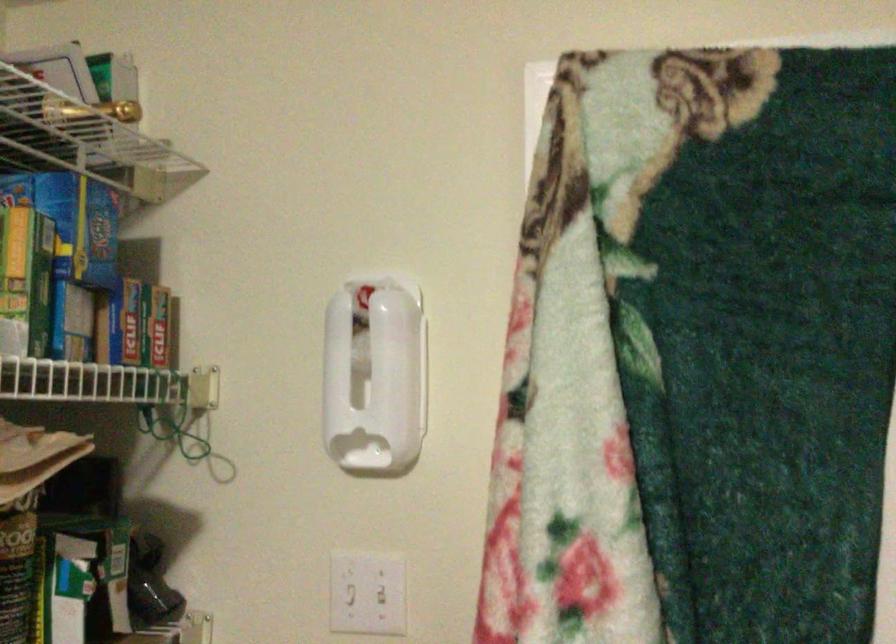
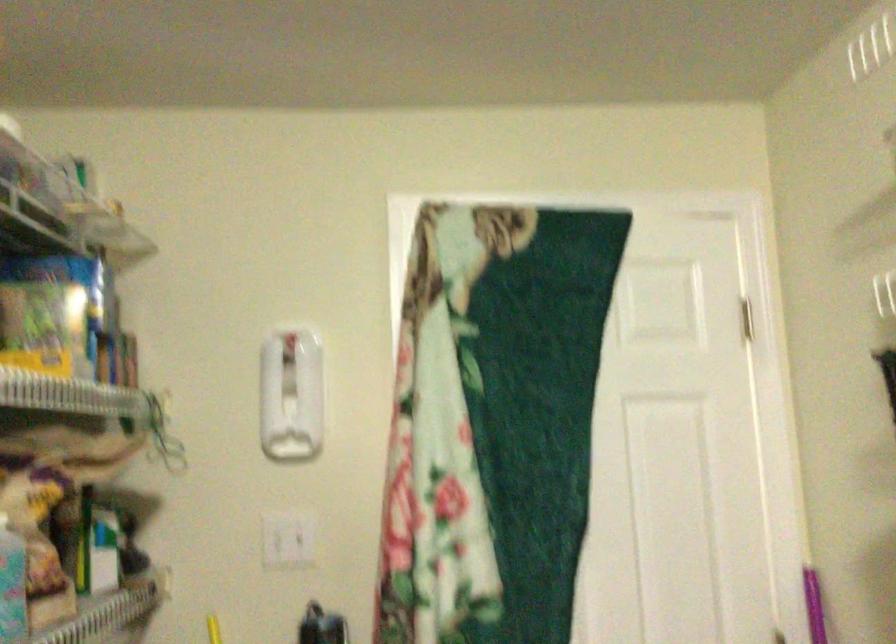
Where in the second image is the point corresponding to [375,382] from the first image?

(290, 395)